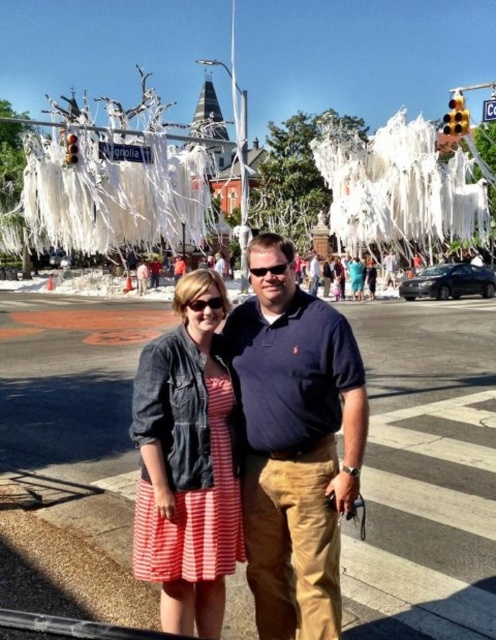
Question: Is dark blue cotton polo shirt at center smaller than striped cotton dress at center?

Choices:
 (A) no
 (B) yes

Answer: (A)

Question: In this image, where is dark blue cotton polo shirt at center located relative to striped cotton dress at center?

Choices:
 (A) below
 (B) above

Answer: (B)

Question: Which of the following is the closest to the observer?

Choices:
 (A) (221, 520)
 (B) (271, 486)

Answer: (A)

Question: Does dark blue cotton polo shirt at center have a smaller size compared to striped cotton dress at center?

Choices:
 (A) yes
 (B) no

Answer: (B)